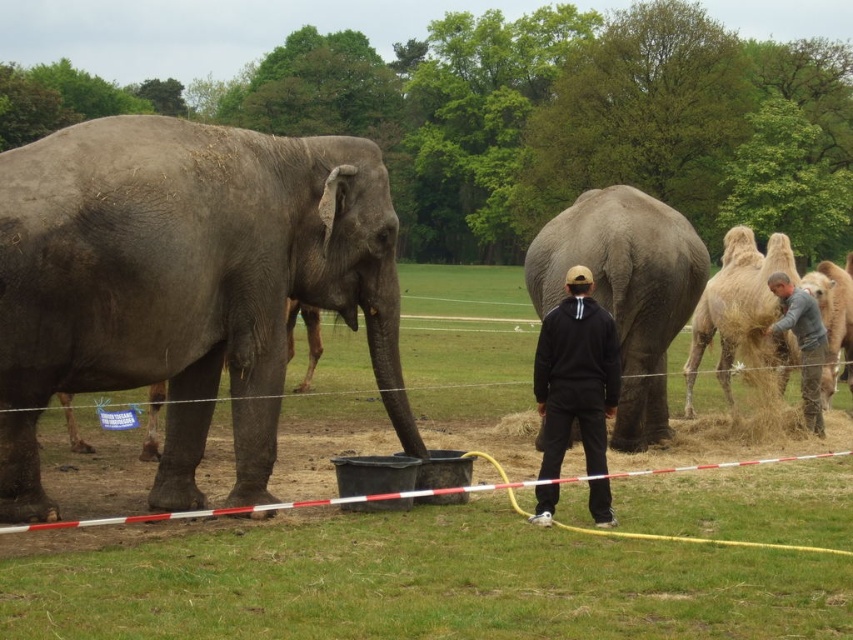
You are standing at the center of the zoo enclosure. There is a point marked at coordinates (x=184, y=284). Which animal is located at that point?

The point at (x=184, y=284) corresponds to the gray matte elephant at left.

Based on the photo, you are standing in the zoo looking at the elephants and camels. There are two points marked in the image. The first point is at coordinate point (115, 282) and the second is at point (610, 516). Which point is closer to you?

Point (115, 282) is closer to the viewer than point (610, 516).

You are standing in the zoo and want to take a photo of the gray matte elephant at center without getting too close. If your camera can focus on objects up to 10 meters away, will you be able to take a clear photo from your current position?

The gray matte elephant at center is 9.84 meters from viewer, so yes, the camera can focus on it since it is within the 10 meters range.